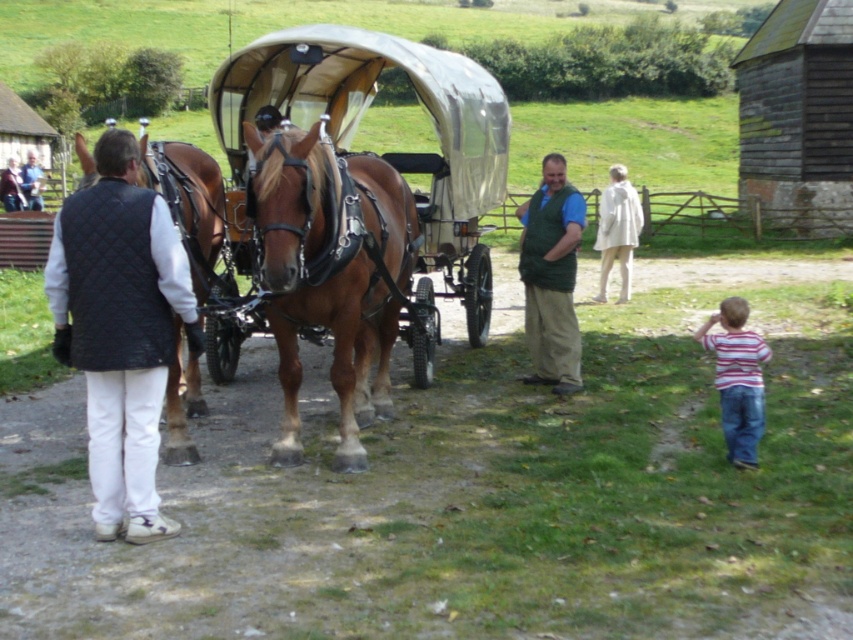
Question: Which object is positioned farthest from the shiny brown leather horse cart at center?

Choices:
 (A) striped shirt at lower right
 (B) brown glossy horse at left
 (C) green quilted vest at center

Answer: (A)

Question: Which point appears farthest from the camera in this image?

Choices:
 (A) (724, 365)
 (B) (198, 166)
 (C) (283, 412)
 (D) (428, 113)

Answer: (D)

Question: Does shiny brown leather horse cart at center have a greater width compared to brown leather horse at center?

Choices:
 (A) yes
 (B) no

Answer: (A)

Question: Can you confirm if shiny brown leather horse cart at center is positioned above brown glossy horse at left?

Choices:
 (A) no
 (B) yes

Answer: (B)

Question: Is brown leather horse at center to the right of brown glossy horse at left from the viewer's perspective?

Choices:
 (A) yes
 (B) no

Answer: (A)

Question: Which of the following is the farthest from the observer?

Choices:
 (A) brown glossy horse at left
 (B) green quilted vest at center

Answer: (B)